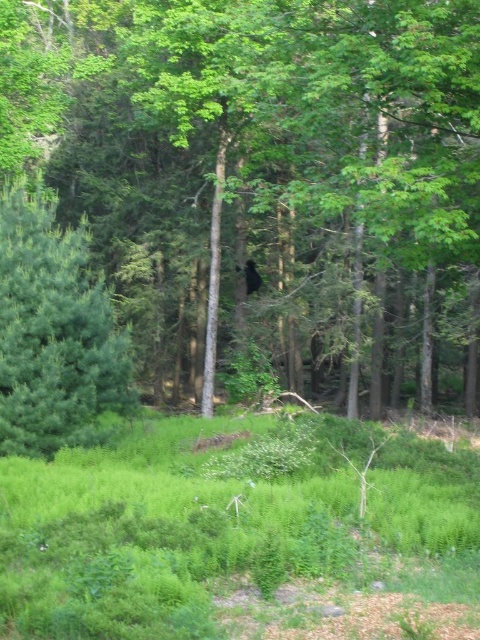
Question: Which object is positioned closest to the green leafy grass at center?

Choices:
 (A) green leafy tree at center
 (B) green matte tree at left

Answer: (B)

Question: Does green leafy tree at center have a smaller size compared to green matte tree at left?

Choices:
 (A) no
 (B) yes

Answer: (A)

Question: Which of the following is the closest to the observer?

Choices:
 (A) (338, 570)
 (B) (277, 45)

Answer: (A)

Question: Is green leafy grass at center smaller than green matte tree at left?

Choices:
 (A) yes
 (B) no

Answer: (B)

Question: Which object appears farthest from the camera in this image?

Choices:
 (A) green matte tree at left
 (B) green leafy tree at center
 (C) green leafy grass at center

Answer: (A)

Question: Can you confirm if green leafy grass at center is thinner than green matte tree at left?

Choices:
 (A) yes
 (B) no

Answer: (B)